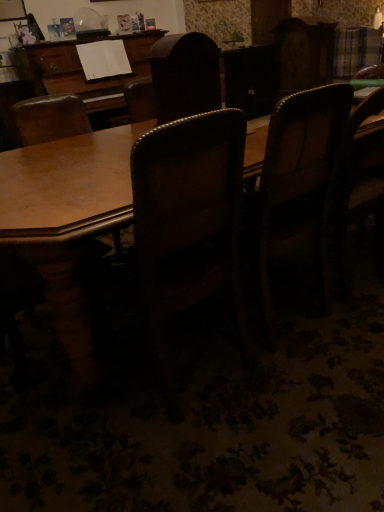
Question: Does dark wood chair at right, the second chair positioned from the right, have a lesser width compared to wooden chair at center, the fourth chair in the right-to-left sequence?

Choices:
 (A) no
 (B) yes

Answer: (B)

Question: Is dark wood chair at right, positioned as the third chair in left-to-right order, next to wooden chair at center, the first chair positioned from the left, and touching it?

Choices:
 (A) no
 (B) yes

Answer: (A)

Question: Is dark wood chair at right, the second chair positioned from the right, facing towards wooden chair at center, the first chair positioned from the left?

Choices:
 (A) yes
 (B) no

Answer: (B)

Question: Can you confirm if dark wood chair at right, the second chair positioned from the right, is taller than wooden chair at center, the first chair positioned from the left?

Choices:
 (A) no
 (B) yes

Answer: (A)

Question: From a real-world perspective, is dark wood chair at right, positioned as the third chair in left-to-right order, under wooden chair at center, the first chair positioned from the left?

Choices:
 (A) no
 (B) yes

Answer: (B)

Question: From the image's perspective, is dark wood chair at center, which ranks as the 2th chair in left-to-right order, above or below wooden chair at right, marked as the 4th chair in a left-to-right arrangement?

Choices:
 (A) above
 (B) below

Answer: (A)

Question: Looking at their shapes, would you say dark wood chair at center, which appears as the 3th chair when viewed from the right, is wider or thinner than wooden chair at right, the 1th chair viewed from the right?

Choices:
 (A) wide
 (B) thin

Answer: (B)

Question: Choose the correct answer: Is dark wood chair at center, which appears as the 3th chair when viewed from the right, inside wooden chair at right, marked as the 4th chair in a left-to-right arrangement, or outside it?

Choices:
 (A) inside
 (B) outside

Answer: (B)

Question: From their relative heights in the image, would you say dark wood chair at center, which ranks as the 2th chair in left-to-right order, is taller or shorter than wooden chair at right, marked as the 4th chair in a left-to-right arrangement?

Choices:
 (A) tall
 (B) short

Answer: (B)

Question: Is wooden chair at right, marked as the 4th chair in a left-to-right arrangement, situated inside dark wood chair at center, which appears as the 3th chair when viewed from the right, or outside?

Choices:
 (A) outside
 (B) inside

Answer: (A)

Question: Considering the positions of wooden chair at right, marked as the 4th chair in a left-to-right arrangement, and dark wood chair at center, which ranks as the 2th chair in left-to-right order, in the image, is wooden chair at right, marked as the 4th chair in a left-to-right arrangement, bigger or smaller than dark wood chair at center, which ranks as the 2th chair in left-to-right order,?

Choices:
 (A) big
 (B) small

Answer: (A)

Question: From the image's perspective, is wooden chair at right, the 1th chair viewed from the right, located above or below dark wood chair at center, which ranks as the 2th chair in left-to-right order?

Choices:
 (A) below
 (B) above

Answer: (A)

Question: Is wooden chair at right, the 1th chair viewed from the right, in front of or behind dark wood chair at center, which ranks as the 2th chair in left-to-right order, in the image?

Choices:
 (A) front
 (B) behind

Answer: (B)

Question: From the image's perspective, is dark wood chair at right, positioned as the third chair in left-to-right order, located above or below wooden chair at right, the 1th chair viewed from the right?

Choices:
 (A) above
 (B) below

Answer: (B)

Question: Considering the positions of dark wood chair at right, the second chair positioned from the right, and wooden chair at right, the 1th chair viewed from the right, in the image, is dark wood chair at right, the second chair positioned from the right, bigger or smaller than wooden chair at right, the 1th chair viewed from the right,?

Choices:
 (A) big
 (B) small

Answer: (A)